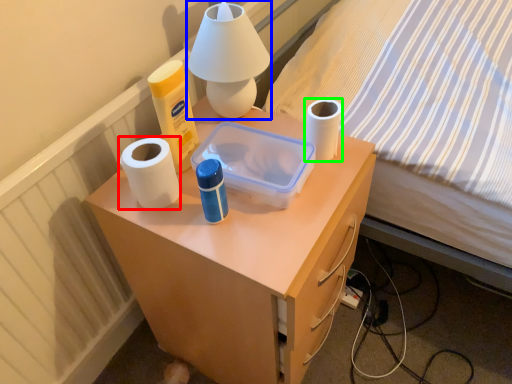
Question: Which is nearer to the paper towel (highlighted by a red box)? table lamp (highlighted by a blue box) or toilet paper (highlighted by a green box).

Choices:
 (A) table lamp
 (B) toilet paper

Answer: (A)